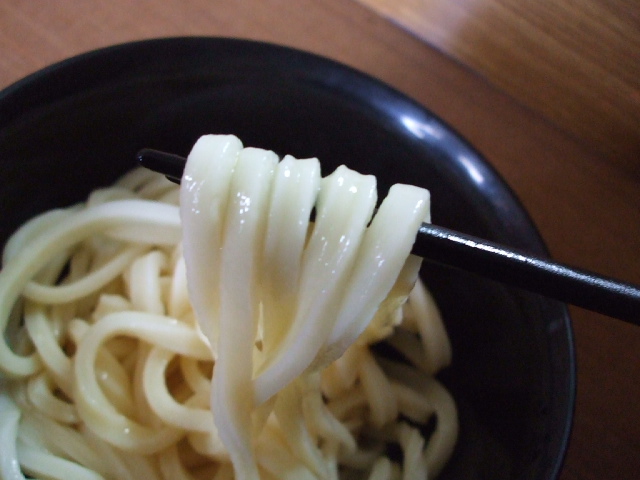
The image size is (640, 480). Find the location of `chopstick`. chopstick is located at coordinates (626, 299), (527, 277), (447, 238), (164, 163).